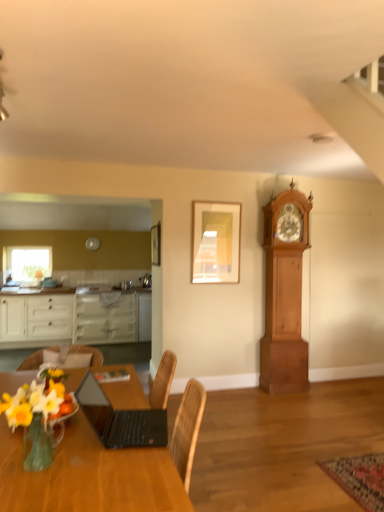
Describe the element at coordinates (156, 244) in the screenshot. The image size is (384, 512). I see `matte wood picture frame at upper center, the second picture frame in the right-to-left sequence` at that location.

Find the location of a particular element. clear glass window at upper left is located at coordinates (27, 262).

You are a GUI agent. You are given a task and a screenshot of the screen. Output one action in this format:
    pyautogui.click(x=<x>, y=<y>)
    Task: Click on the wooden chair at lower left
    The width and height of the screenshot is (384, 512).
    Given the screenshot: What is the action you would take?
    pyautogui.click(x=37, y=358)

This screenshot has width=384, height=512. I want to click on white glossy cabinets at left, so point(75,318).

At what (x,y) coordinates should I click in order to perform the action: click on matte wood picture frame at upper center, positioned as the 1th picture frame in left-to-right order. Please return your answer as a coordinate pair (x, y). The width and height of the screenshot is (384, 512). Looking at the image, I should click on (156, 244).

Which is nearer, (114, 423) or (20, 422)?

Point (114, 423) is farther from the camera than point (20, 422).

Which of these two, black matte laptop at center or translucent glass vase at lower left, stands taller?

Standing taller between the two is translucent glass vase at lower left.

I want to click on laptop lying behind the translucent glass vase at lower left, so click(120, 419).

Is black matte laptop at center far away from translucent glass vase at lower left?

No.

Is black matte laptop at center outside of light brown wooden clock at right?

That's correct, black matte laptop at center is outside of light brown wooden clock at right.

Which object is positioned more to the left, black matte laptop at center or light brown wooden clock at right?

black matte laptop at center is more to the left.

Is black matte laptop at center closer to the viewer compared to light brown wooden clock at right?

Yes.

From a real-world perspective, which is physically below, matte gold picture frame at upper center, arranged as the first picture frame when viewed from the right, or translucent glass vase at lower left?

In real-world perspective, translucent glass vase at lower left is lower.

Who is shorter, matte gold picture frame at upper center, the second picture frame positioned from the left, or translucent glass vase at lower left?

Standing shorter between the two is translucent glass vase at lower left.

Is point (215, 263) farther from viewer compared to point (61, 377)?

Yes, point (215, 263) is behind point (61, 377).

Which object is further away from the camera taking this photo, matte gold picture frame at upper center, the second picture frame positioned from the left, or translucent glass vase at lower left?

matte gold picture frame at upper center, the second picture frame positioned from the left, is further from the camera.

Considering the sizes of light brown wooden clock at right and matte wood picture frame at upper center, the second picture frame in the right-to-left sequence, in the image, is light brown wooden clock at right wider or thinner than matte wood picture frame at upper center, the second picture frame in the right-to-left sequence,?

In the image, light brown wooden clock at right appears to be wider than matte wood picture frame at upper center, the second picture frame in the right-to-left sequence.

Who is shorter, light brown wooden clock at right or matte wood picture frame at upper center, positioned as the 1th picture frame in left-to-right order?

Standing shorter between the two is matte wood picture frame at upper center, positioned as the 1th picture frame in left-to-right order.

Is light brown wooden clock at right bigger than matte wood picture frame at upper center, positioned as the 1th picture frame in left-to-right order?

Yes, light brown wooden clock at right is bigger than matte wood picture frame at upper center, positioned as the 1th picture frame in left-to-right order.

Does light brown wooden clock at right contain matte wood picture frame at upper center, positioned as the 1th picture frame in left-to-right order?

No, matte wood picture frame at upper center, positioned as the 1th picture frame in left-to-right order, is not inside light brown wooden clock at right.

Is black matte laptop at center at the back of translucent glass vase at lower left?

That's not correct — translucent glass vase at lower left is not looking away from black matte laptop at center.

Locate an element on the screen. This screenshot has width=384, height=512. flower above the black matte laptop at center (from a real-world perspective) is located at coordinates (35, 400).

Considering the positions of objects translucent glass vase at lower left and black matte laptop at center in the image provided, who is more to the left, translucent glass vase at lower left or black matte laptop at center?

From the viewer's perspective, translucent glass vase at lower left appears more on the left side.

Which is further, (64, 393) or (78, 394)?

Positioned behind is point (78, 394).

Is wooden table at lower left at the back of black matte laptop at center?

No, black matte laptop at center is not facing away from wooden table at lower left.

From a real-world perspective, is black matte laptop at center under wooden table at lower left?

No.

Between black matte laptop at center and wooden table at lower left, which one is positioned in front?

wooden table at lower left.

Between black matte laptop at center and wooden table at lower left, which one appears on the right side from the viewer's perspective?

black matte laptop at center is more to the right.

From a real-world perspective, is matte gold picture frame at upper center, the second picture frame positioned from the left, over black matte laptop at center?

Yes.

Between matte gold picture frame at upper center, arranged as the first picture frame when viewed from the right, and black matte laptop at center, which one has less height?

black matte laptop at center is shorter.

Is matte gold picture frame at upper center, the second picture frame positioned from the left, far away from black matte laptop at center?

matte gold picture frame at upper center, the second picture frame positioned from the left, is positioned a significant distance from black matte laptop at center.

Find the location of `flower that appears in front of the black matte laptop at center`. flower that appears in front of the black matte laptop at center is located at coordinates (35, 400).

Locate an element on the screen. Image resolution: width=384 pixels, height=512 pixels. clock that appears on the right of black matte laptop at center is located at coordinates [284, 293].

When comparing their distances from translucent glass vase at lower left, does wooden chair at lower left or black matte laptop at center seem closer?

black matte laptop at center is closer to translucent glass vase at lower left.

Estimate the real-world distances between objects in this image. Which object is further from light brown wooden clock at right, white glossy cabinets at left or wooden chair at lower left?

white glossy cabinets at left is further to light brown wooden clock at right.

Based on their spatial positions, is matte gold picture frame at upper center, arranged as the first picture frame when viewed from the right, or light brown wooden clock at right further from black matte laptop at center?

light brown wooden clock at right.

Considering their positions, is light brown wooden clock at right positioned closer to matte gold picture frame at upper center, arranged as the first picture frame when viewed from the right, than wooden table at lower left?

Among the two, light brown wooden clock at right is located nearer to matte gold picture frame at upper center, arranged as the first picture frame when viewed from the right.

When comparing their distances from light brown wooden clock at right, does black matte laptop at center or white glossy cabinets at left seem closer?

black matte laptop at center is closer to light brown wooden clock at right.

Which object lies nearer to the anchor point light brown wooden clock at right, clear glass window at upper left or matte wood picture frame at upper center, the second picture frame in the right-to-left sequence?

Based on the image, matte wood picture frame at upper center, the second picture frame in the right-to-left sequence, appears to be nearer to light brown wooden clock at right.

From the image, which object appears to be nearer to light brown wooden clock at right, matte wood picture frame at upper center, the second picture frame in the right-to-left sequence, or wooden table at lower left?

matte wood picture frame at upper center, the second picture frame in the right-to-left sequence, is closer to light brown wooden clock at right.

When comparing their distances from wooden table at lower left, does matte gold picture frame at upper center, arranged as the first picture frame when viewed from the right, or black matte laptop at center seem further?

Among the two, matte gold picture frame at upper center, arranged as the first picture frame when viewed from the right, is located further to wooden table at lower left.

In order to click on clock between wooden table at lower left and matte gold picture frame at upper center, arranged as the first picture frame when viewed from the right, from front to back in this screenshot , I will do `click(284, 293)`.

Where is `clock between translucent glass vase at lower left and clear glass window at upper left from front to back`? This screenshot has width=384, height=512. clock between translucent glass vase at lower left and clear glass window at upper left from front to back is located at coordinates (284, 293).

Locate an element on the screen. The image size is (384, 512). clock positioned between translucent glass vase at lower left and white glossy cabinets at left from near to far is located at coordinates (284, 293).

Where is `clock located between translucent glass vase at lower left and matte gold picture frame at upper center, the second picture frame positioned from the left, in the depth direction`? clock located between translucent glass vase at lower left and matte gold picture frame at upper center, the second picture frame positioned from the left, in the depth direction is located at coordinates (284, 293).